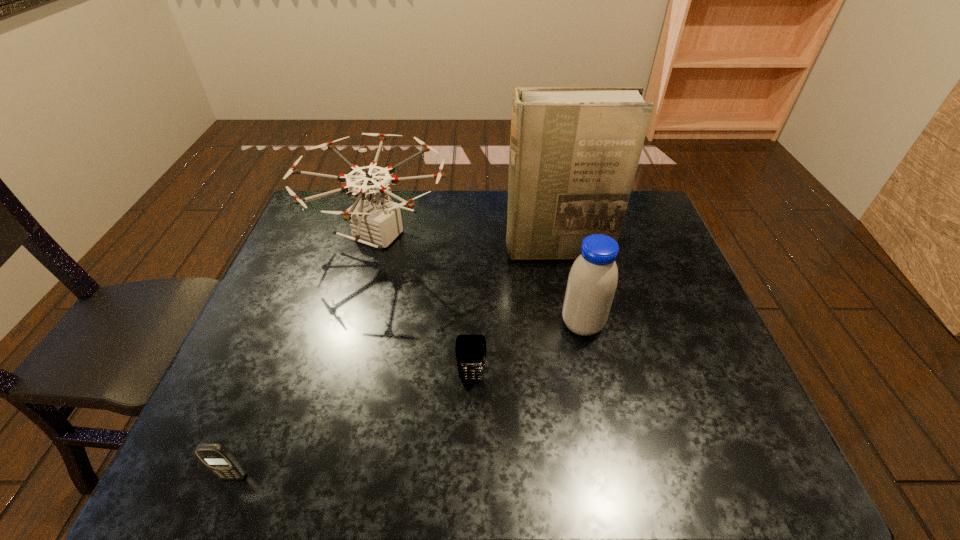
The image size is (960, 540). I want to click on vacant area located 0.070m on the screen of the farther cellular telephone, so click(x=471, y=412).

Where is `object present at the far edge`? Image resolution: width=960 pixels, height=540 pixels. object present at the far edge is located at coordinates (374, 221).

The width and height of the screenshot is (960, 540). Identify the location of object that is positioned at the near edge. (217, 458).

You are a GUI agent. You are given a task and a screenshot of the screen. Output one action in this format:
    pyautogui.click(x=<x>, y=<y>)
    Task: Click on the drone situated at the left edge
    
    Given the screenshot: What is the action you would take?
    pyautogui.click(x=374, y=221)

I want to click on cellular telephone present at the left edge, so click(x=217, y=458).

Locate an element on the screen. This screenshot has height=540, width=960. object located in the far left corner section of the desktop is located at coordinates (374, 221).

The image size is (960, 540). Identify the location of object that is at the near left corner. coord(217,458).

What are the coordinates of `vacant space at the far edge of the desktop` in the screenshot? It's located at (443, 204).

The width and height of the screenshot is (960, 540). In order to click on free space at the left edge in this screenshot , I will do coord(319,302).

Identify the location of vacant region at the right edge. This screenshot has height=540, width=960. (657, 347).